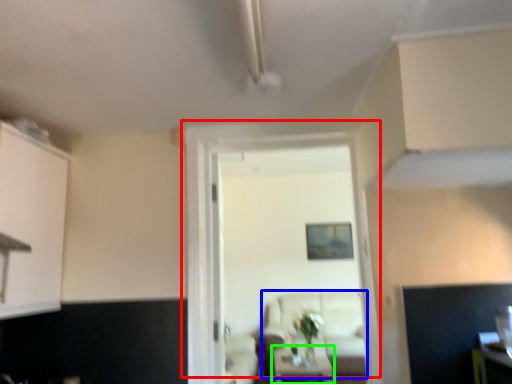
Question: Which object is positioned farthest from door (highlighted by a red box)? Select from couch (highlighted by a blue box) and table (highlighted by a green box).

Choices:
 (A) couch
 (B) table

Answer: (A)